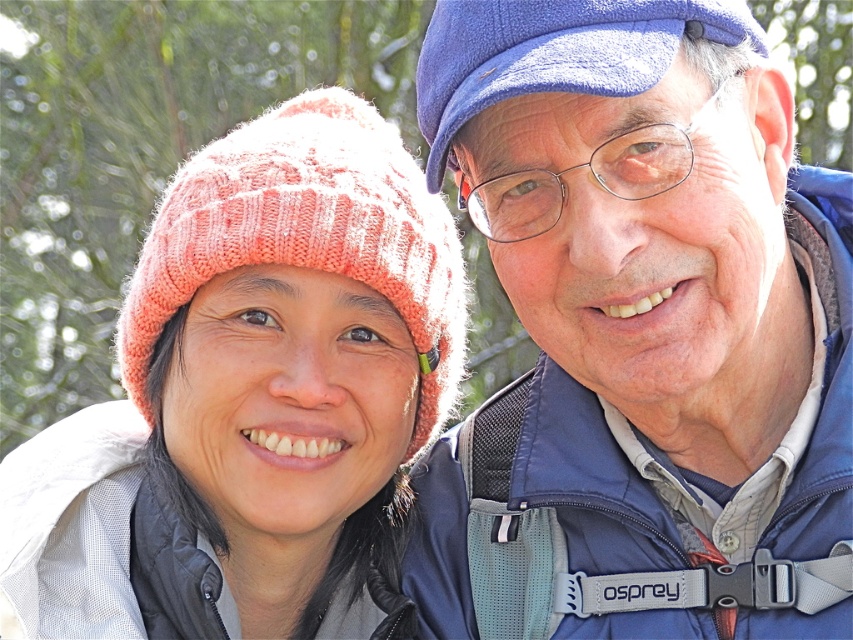
Based on the scene description, where exactly is the blue fabric jacket at upper right located in terms of coordinates?

The blue fabric jacket at upper right is located at point coordinates of [640,332].

You are a hiker trying to navigate between two points marked in the image. The first point is at coordinate point (790, 499) and the second is at point (590, 61). Which point should you aim for first if you want to follow the correct path order?

You should aim for point (590, 61) first because point (790, 499) is behind it, indicating the correct path order starts with the forward point.

You are planning to take a photo of the blue fabric jacket at upper right and the pink knitted beanie at upper left. If you want both items to appear equally sized in the photo, what should you do?

Since the blue fabric jacket at upper right is narrower than the pink knitted beanie at upper left, you should position the camera closer to the blue fabric jacket at upper right and farther from the pink knitted beanie at upper left to make them appear the same size in the photo.